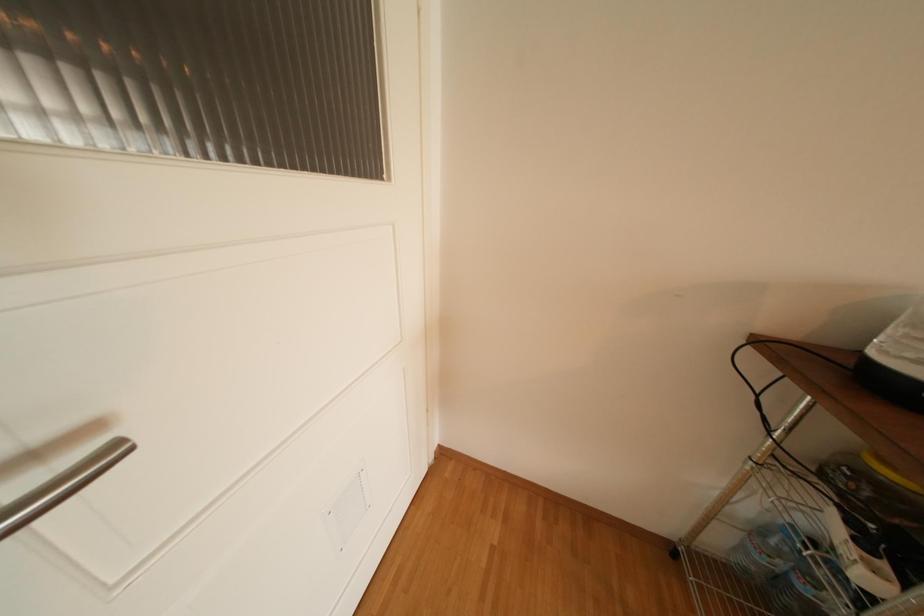
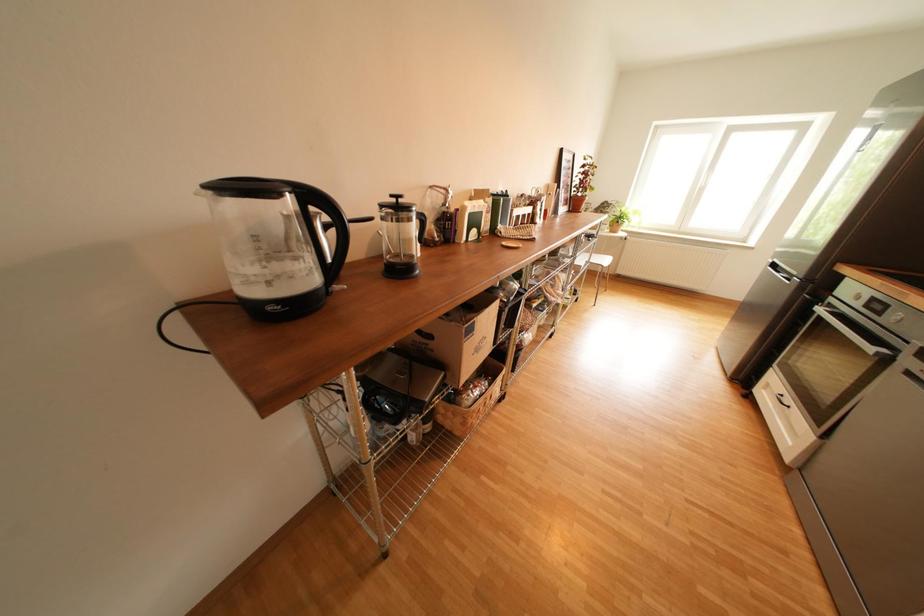
First-person continuous shooting, in which direction is the camera rotating?

The camera's rotation is toward right-down.